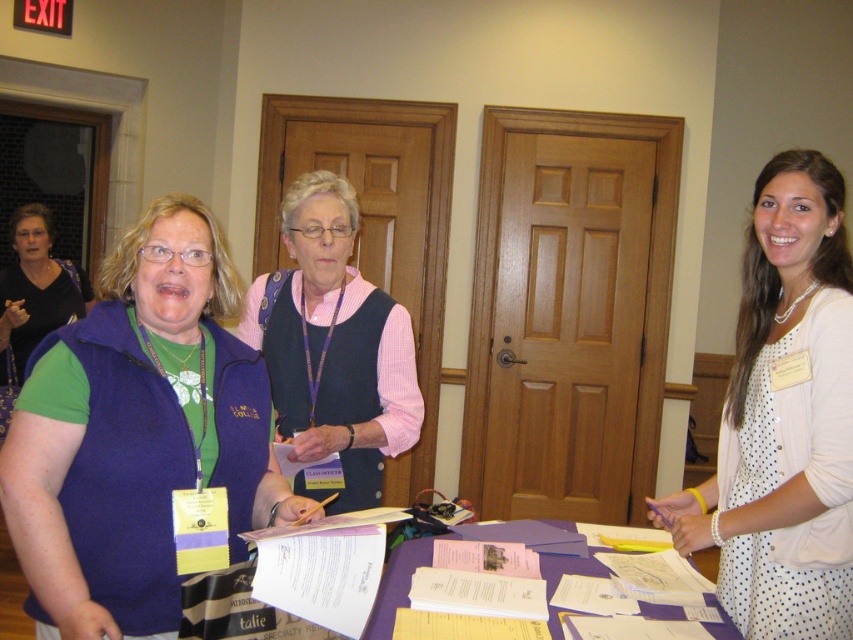
Who is higher up, matte purple vest at center or white dotted dress at center?

white dotted dress at center is higher up.

Can you confirm if matte purple vest at center is positioned above white dotted dress at center?

No, matte purple vest at center is not above white dotted dress at center.

The height and width of the screenshot is (640, 853). Identify the location of matte purple vest at center. (138, 435).

Between point (32, 595) and point (397, 600), which one is positioned behind?

The point (397, 600) is behind.

Who is lower down, matte purple vest at center or purple paper at center?

purple paper at center

Based on the photo, who is more distant from viewer, [229,268] or [386,588]?

The point [386,588] is more distant.

Locate an element on the screen. Image resolution: width=853 pixels, height=640 pixels. matte purple vest at center is located at coordinates (138, 435).

Is matte purple vest at center in front of pink woven vest at center?

Yes, it is.

Who is shorter, matte purple vest at center or pink woven vest at center?

With less height is matte purple vest at center.

Measure the distance between point (86, 572) and camera.

4.38 feet

Where is `matte purple vest at center`? The width and height of the screenshot is (853, 640). matte purple vest at center is located at coordinates (138, 435).